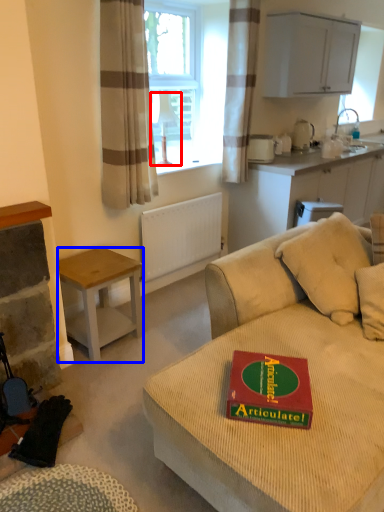
Question: Which object appears farthest to the camera in this image, lamp (highlighted by a red box) or desk (highlighted by a blue box)?

Choices:
 (A) lamp
 (B) desk

Answer: (A)